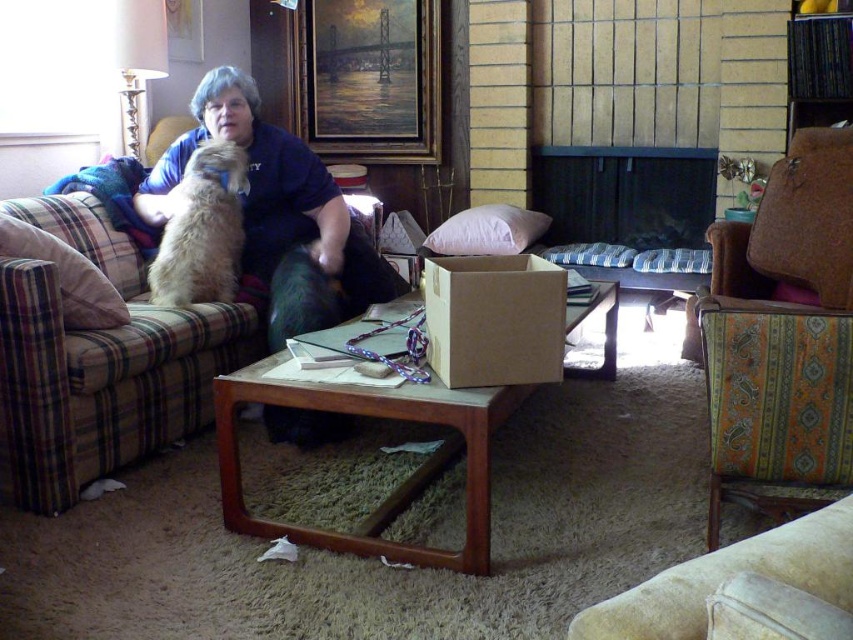
Question: Which point is closer to the camera?

Choices:
 (A) fuzzy beige dog at upper left
 (B) patterned fabric chair at lower right

Answer: (B)

Question: Which point appears closest to the camera in this image?

Choices:
 (A) (527, 218)
 (B) (160, 435)
 (C) (724, 404)

Answer: (C)

Question: Which object is the closest to the patterned fabric chair at lower right?

Choices:
 (A) white soft pillow at center
 (B) plaid fabric pillow at left
 (C) plaid fabric couch at left
 (D) brown cardboard box at center

Answer: (D)

Question: Can you confirm if plaid fabric couch at left is bigger than plaid fabric pillow at left?

Choices:
 (A) yes
 (B) no

Answer: (A)

Question: Is plaid fabric couch at left positioned at the back of fuzzy beige dog at upper left?

Choices:
 (A) no
 (B) yes

Answer: (A)

Question: Does plaid fabric couch at left have a smaller size compared to patterned fabric chair at lower right?

Choices:
 (A) yes
 (B) no

Answer: (B)